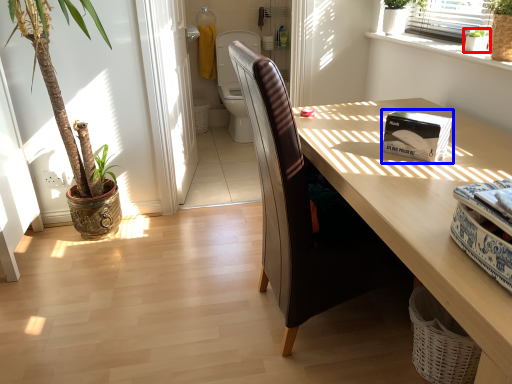
Question: Among these objects, which one is farthest to the camera, houseplant (highlighted by a red box) or box (highlighted by a blue box)?

Choices:
 (A) houseplant
 (B) box

Answer: (A)